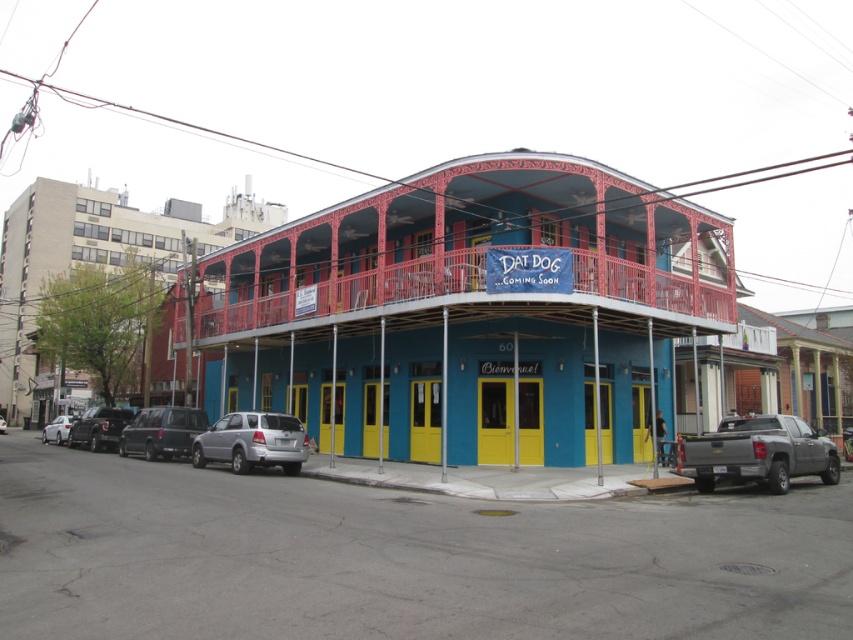
You are a delivery person who needs to park your truck between the gray metallic truck at lower right and the matte black truck at lower left. The parking space between them is 75.89 feet long. If your truck is 25 feet long, can you safely park your truck there?

The distance between the gray metallic truck at lower right and the matte black truck at lower left is 75.89 feet, which is more than enough to accommodate a 25 feet long truck. Yes, you can safely park your truck there.

From the picture: You are a delivery person who needs to park your truck between two existing trucks in the image. The gray metallic truck at lower right and the matte black truck at lower left are already parked. Where should you position your truck to maintain the existing parking order?

You should park your truck to the left of the matte black truck at lower left to maintain the existing order since the gray metallic truck at lower right is already to the right of the matte black truck at lower left.

From the picture: You are standing in front of the building and want to determine which of the two points, point (402, 321) or point (0, 420), is closer to you. Based on the scene description, which point is nearer?

Point (402, 321) is closer to the viewer than point (0, 420).